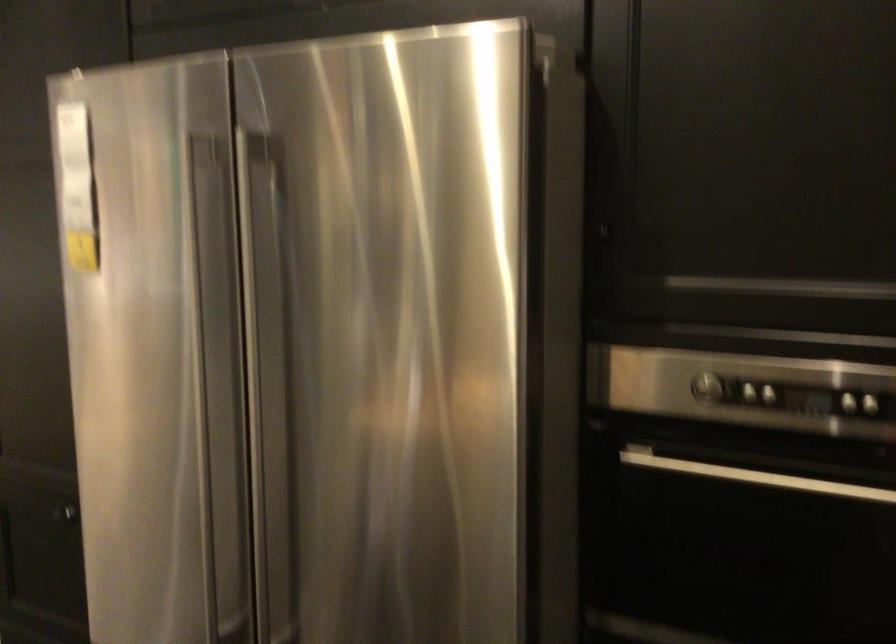
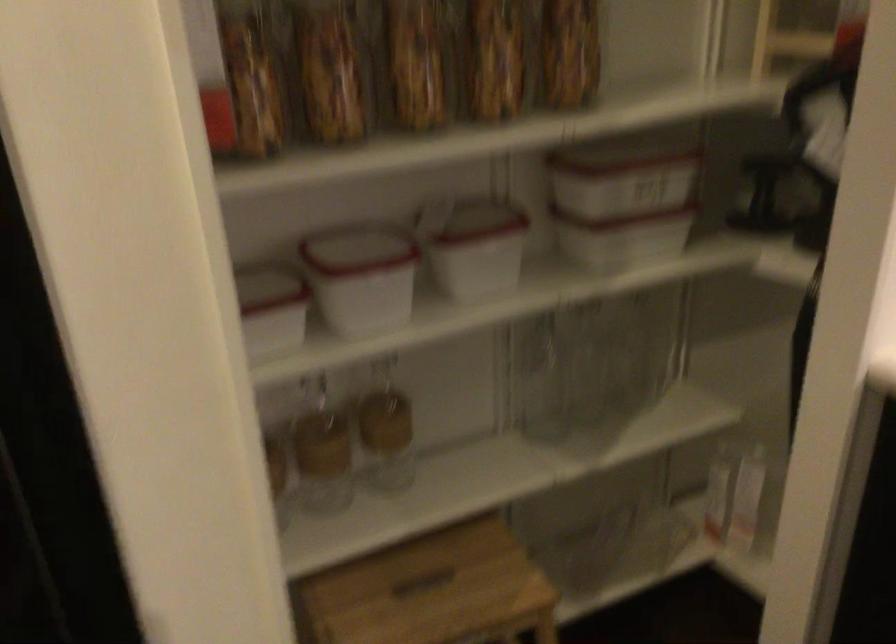
First-person continuous shooting, in which direction is the camera rotating?

The camera's rotation is toward right-down.